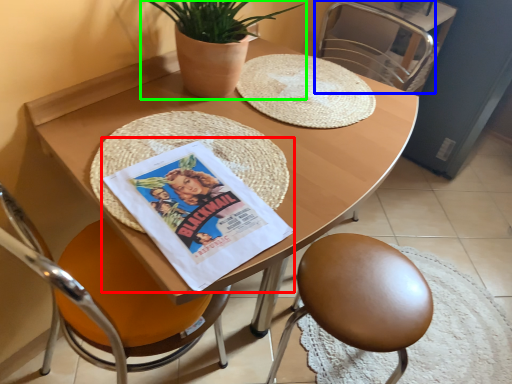
Question: Which is farther away from comic book (highlighted by a red box)? chair (highlighted by a blue box) or houseplant (highlighted by a green box)?

Choices:
 (A) chair
 (B) houseplant

Answer: (A)